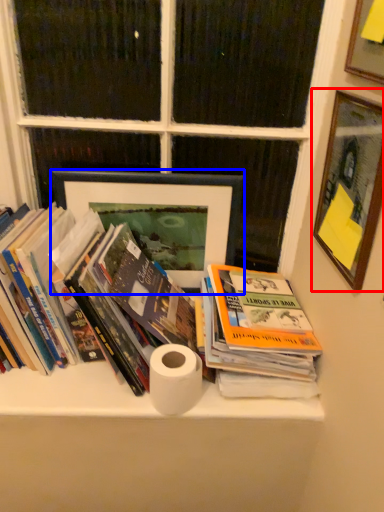
Question: Which of the following is the farthest to the observer, picture frame (highlighted by a red box) or picture frame (highlighted by a blue box)?

Choices:
 (A) picture frame
 (B) picture frame

Answer: (B)